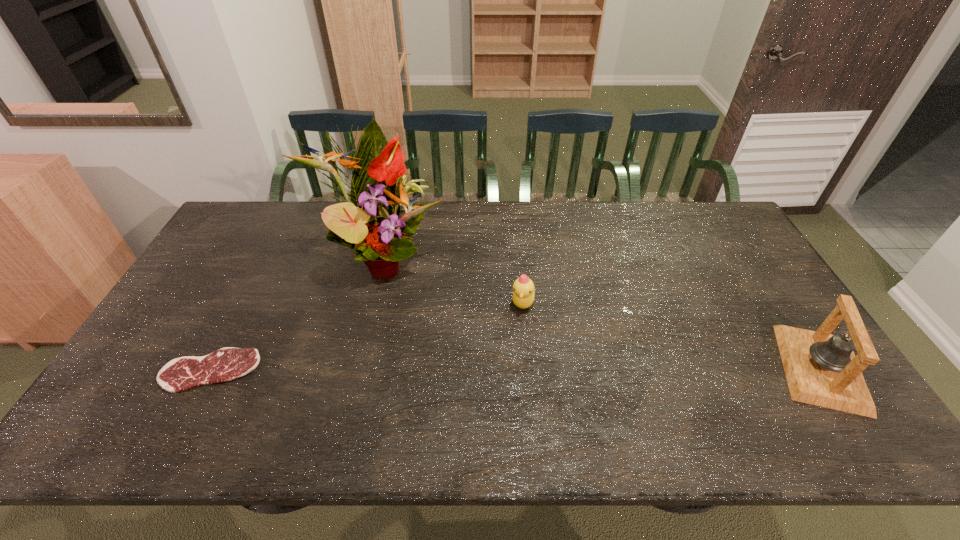
I want to click on the leftmost object, so click(180, 374).

Locate an element on the screen. This screenshot has height=540, width=960. the shortest object is located at coordinates (180, 374).

Where is `the rightmost object`? the rightmost object is located at coordinates (821, 369).

The image size is (960, 540). I want to click on the second tallest object, so click(821, 369).

Locate an element on the screen. This screenshot has width=960, height=540. bouquet is located at coordinates (x=369, y=223).

You are a GUI agent. You are given a task and a screenshot of the screen. Output one action in this format:
    pyautogui.click(x=<x>, y=<y>)
    Task: Click on the tallest object
    The image size is (960, 540).
    Given the screenshot: What is the action you would take?
    pyautogui.click(x=369, y=223)

The image size is (960, 540). I want to click on the third tallest object, so click(523, 296).

Identify the location of duckling. (523, 296).

At what (x,y) coordinates should I click in order to perform the action: click on free space located on the right of the shortest object. Please return your answer as a coordinate pair (x, y). The image size is (960, 540). Looking at the image, I should click on (296, 370).

Find the location of a particular element. free location located on the back of the bell is located at coordinates (771, 292).